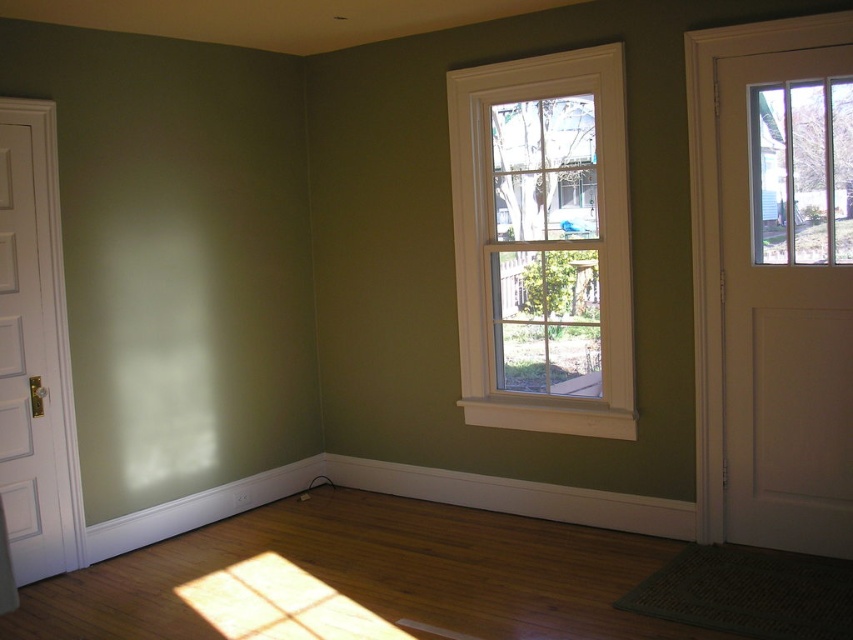
Question: Is white wood window at center positioned before white wood door at left?

Choices:
 (A) no
 (B) yes

Answer: (A)

Question: Which object is the closest to the white wood door at right?

Choices:
 (A) white wood door at left
 (B) white wood window at center

Answer: (B)

Question: Is white wood window at center closer to camera compared to white wood door at left?

Choices:
 (A) no
 (B) yes

Answer: (A)

Question: Which of the following is the closest to the observer?

Choices:
 (A) (688, 36)
 (B) (57, 464)

Answer: (A)

Question: Is white wood window at center smaller than white wood door at left?

Choices:
 (A) yes
 (B) no

Answer: (B)

Question: Which object appears farthest from the camera in this image?

Choices:
 (A) white wood door at left
 (B) white wood window at center

Answer: (B)